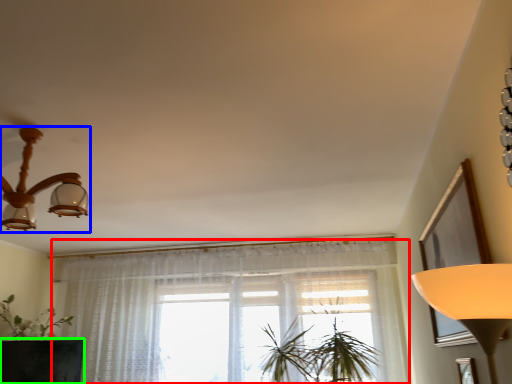
Question: Which is nearer to the curtain (highlighted by a red box)? lamp (highlighted by a blue box) or round table (highlighted by a green box).

Choices:
 (A) lamp
 (B) round table

Answer: (B)